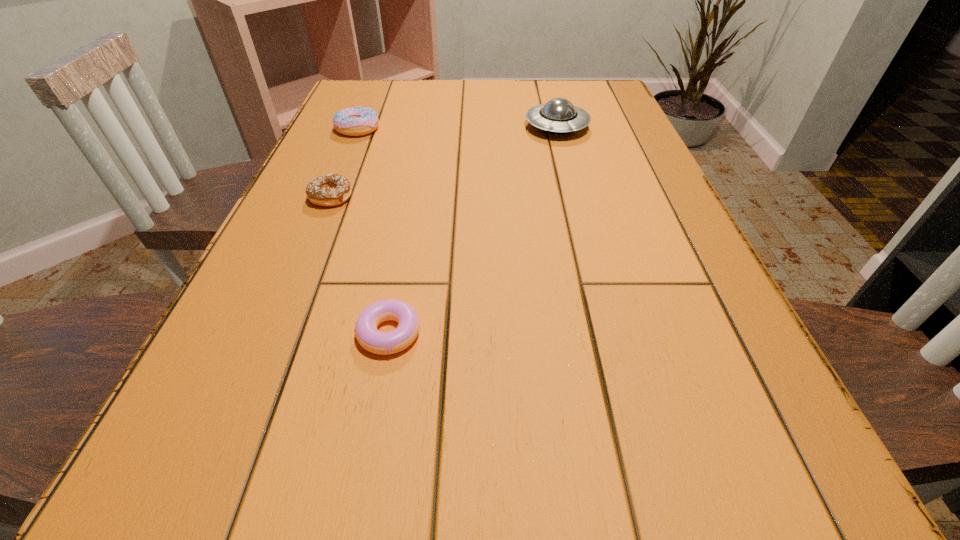
In order to click on vacant space that's between the shortest doughnut and the second farthest doughnut in this screenshot , I will do `click(360, 265)`.

The width and height of the screenshot is (960, 540). Identify the location of unoccupied position between the second tallest object and the shortest doughnut. (373, 231).

The height and width of the screenshot is (540, 960). I want to click on vacant space that is in between the second farthest doughnut and the second object from right to left, so click(360, 265).

Find the location of `free space between the shortest doughnut and the second farthest doughnut`. free space between the shortest doughnut and the second farthest doughnut is located at coordinates (360, 265).

Locate an element on the screen. The width and height of the screenshot is (960, 540). free spot between the nearest object and the third shortest object is located at coordinates (373, 231).

The image size is (960, 540). Find the location of `empty space between the farthest doughnut and the nearest object`. empty space between the farthest doughnut and the nearest object is located at coordinates (373, 231).

Where is `vacant space in between the second nearest doughnut and the tallest object`? This screenshot has width=960, height=540. vacant space in between the second nearest doughnut and the tallest object is located at coordinates (444, 162).

Find the location of a particular element. This screenshot has height=540, width=960. vacant area between the rightmost object and the nearest doughnut is located at coordinates (473, 230).

Where is `free space that is in between the rightmost object and the shortest object`? Image resolution: width=960 pixels, height=540 pixels. free space that is in between the rightmost object and the shortest object is located at coordinates (473, 230).

Identify the location of object that is the second closest to the rightmost doughnut. The image size is (960, 540). (357, 121).